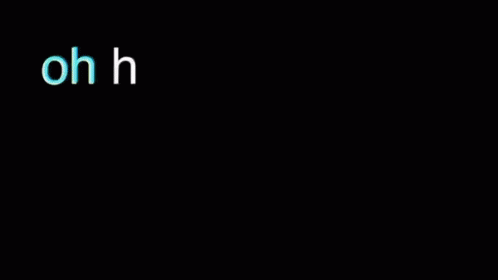
Image resolution: width=498 pixels, height=280 pixels. I want to click on garbage can, so coord(335,147).